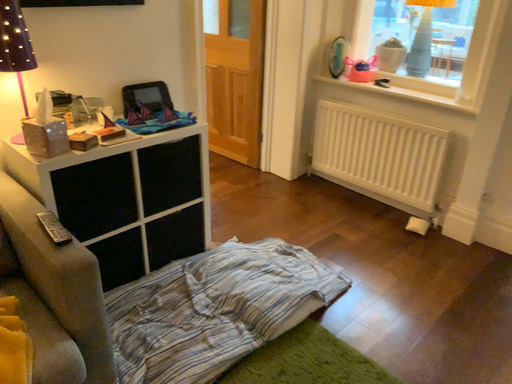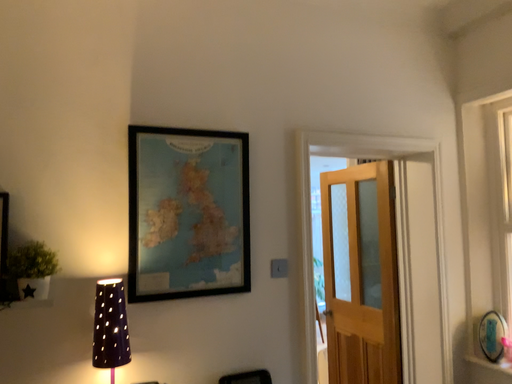
Question: How did the camera likely rotate when shooting the video?

Choices:
 (A) rotated left
 (B) rotated right

Answer: (A)